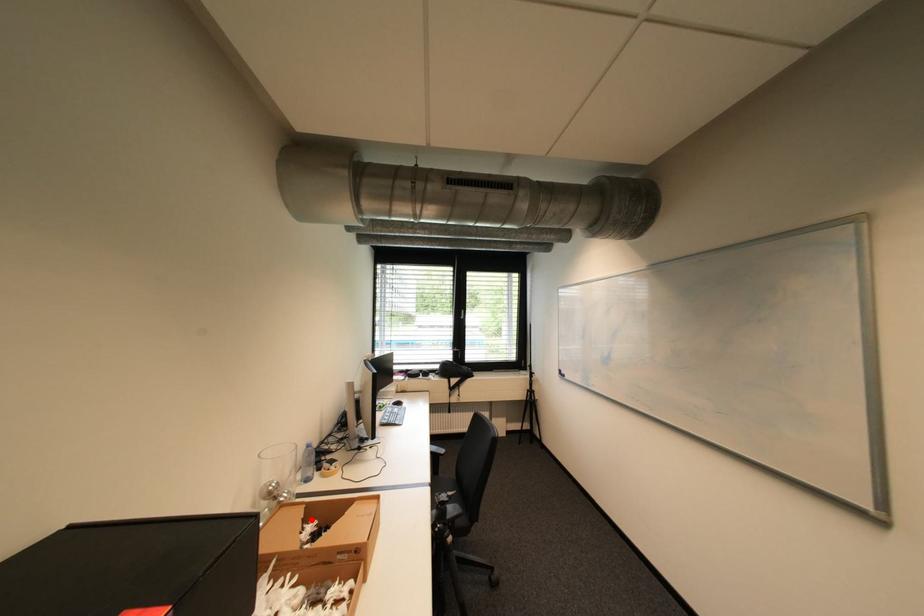
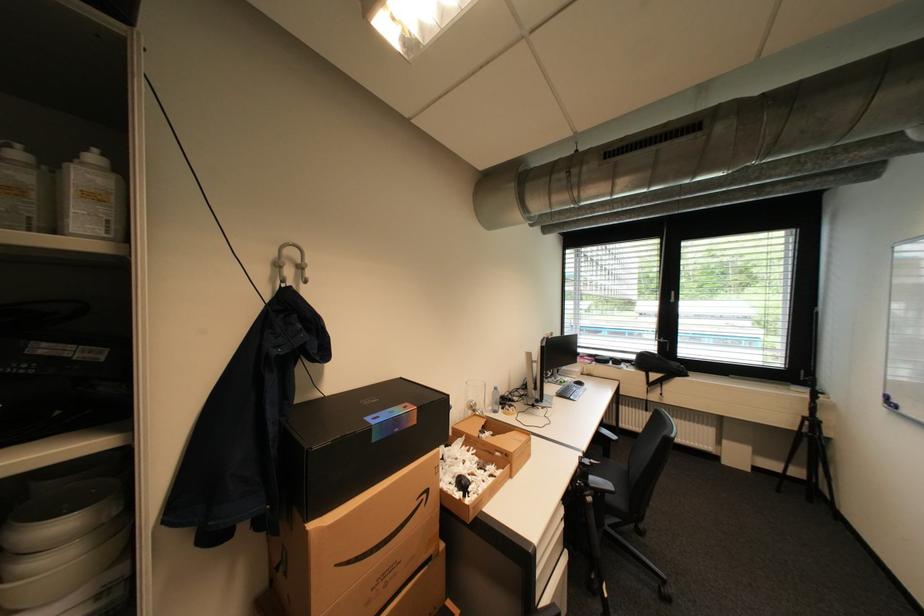
Find the pixel in the second image that matches the highlighted location in the first image.

(492, 426)